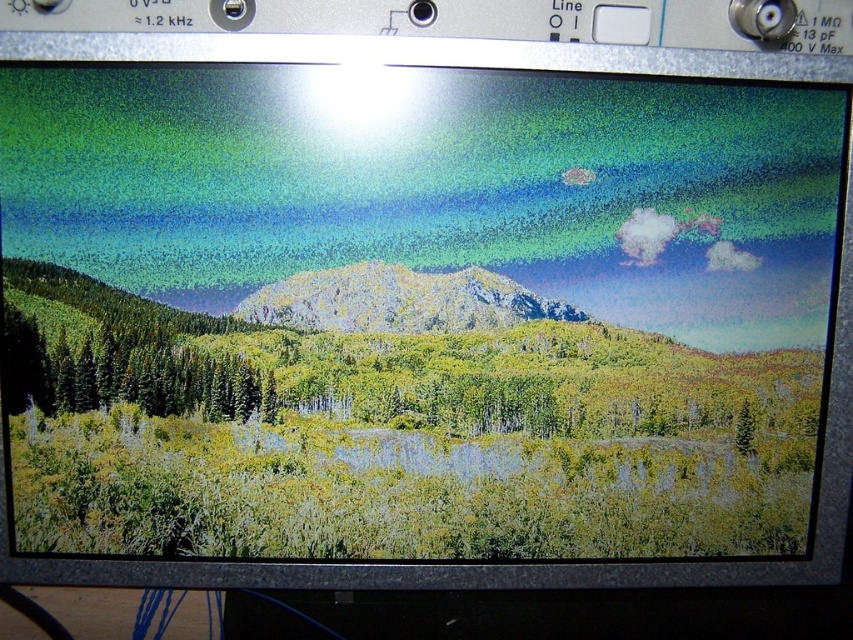
Question: Which of the following is the farthest from the observer?

Choices:
 (A) (248, 396)
 (B) (349, 269)
 (C) (747, 420)

Answer: (C)

Question: Estimate the real-world distances between objects in this image. Which object is farther from the rocky mountain at center?

Choices:
 (A) green matte tree at left
 (B) green matte tree at lower right

Answer: (B)

Question: Does green matte tree at left have a smaller size compared to green matte tree at lower right?

Choices:
 (A) yes
 (B) no

Answer: (B)

Question: Is green matte tree at left thinner than rocky mountain at center?

Choices:
 (A) no
 (B) yes

Answer: (B)

Question: Among these objects, which one is farthest from the camera?

Choices:
 (A) green matte tree at lower right
 (B) green matte tree at left
 (C) rocky mountain at center

Answer: (A)

Question: Considering the relative positions of rocky mountain at center and green matte tree at lower right in the image provided, where is rocky mountain at center located with respect to green matte tree at lower right?

Choices:
 (A) below
 (B) above

Answer: (B)